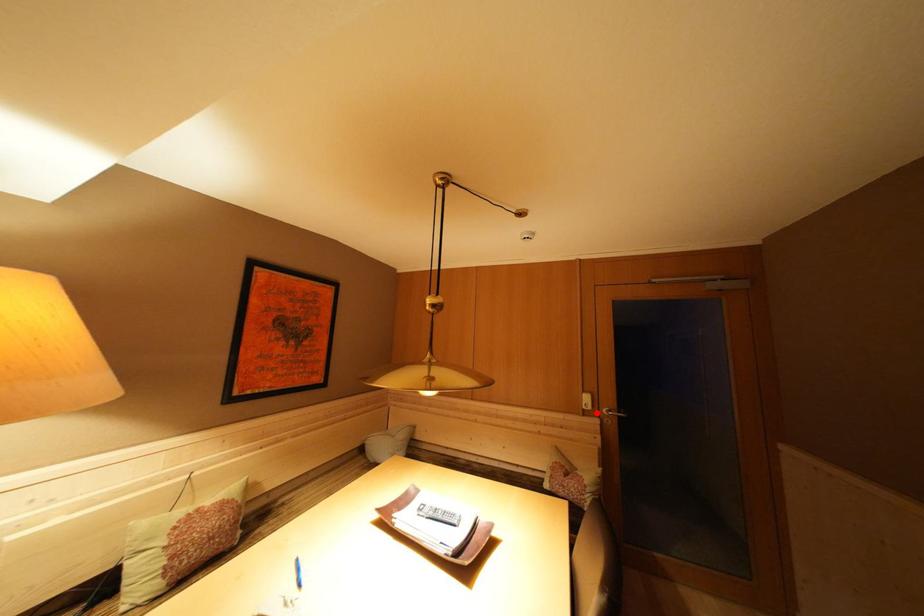
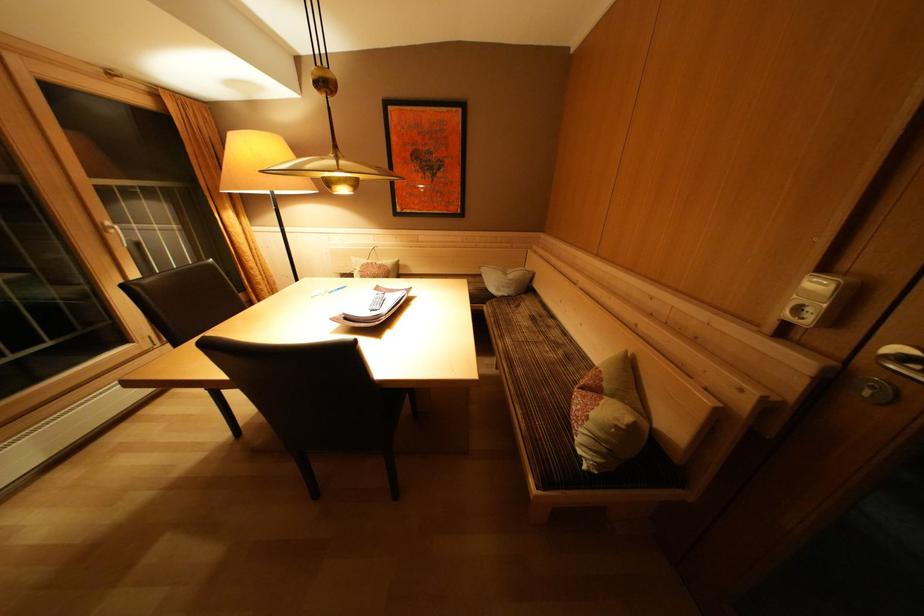
The point at the highlighted location is marked in the first image. Where is the corresponding point in the second image?

(815, 326)